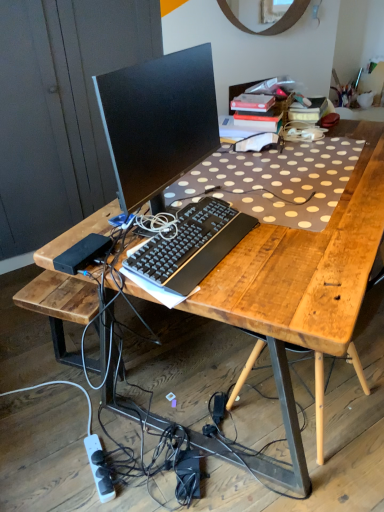
At what (x,y) coordinates should I click in order to perform the action: click on wooden desk at center. Please return your answer as a coordinate pair (x, y). Looking at the image, I should click on (304, 281).

At what (x,y) coordinates should I click in order to perform the action: click on white plastic power strip at lower left. Please return your answer as a coordinate pair (x, y). Image resolution: width=384 pixels, height=512 pixels. Looking at the image, I should click on (99, 469).

From the image's perspective, which object appears higher, wooden desk at center or matte black monitor at center?

matte black monitor at center.

Considering the sizes of wooden desk at center and matte black monitor at center in the image, is wooden desk at center bigger or smaller than matte black monitor at center?

In the image, wooden desk at center appears to be larger than matte black monitor at center.

Which is closer, [318,236] or [200,66]?

Point [318,236] appears to be farther away from the viewer than point [200,66].

Find the location of a particular element. desk lying on the right of matte black monitor at center is located at coordinates (304, 281).

Is wooden at right completely or partially inside matte black monitor at center?

No, wooden at right is not inside matte black monitor at center.

Does matte black monitor at center have a lesser height compared to wooden at right?

Yes.

Is matte black monitor at center in contact with wooden at right?

No, matte black monitor at center is not beside wooden at right.

What's the angular difference between wooden at right and matte black monitor at center's facing directions?

179 degrees.

Who is shorter, wooden at right or matte black monitor at center?

Standing shorter between the two is matte black monitor at center.

Based on the photo, could you tell me if wooden at right is facing matte black monitor at center?

No, wooden at right is not aimed at matte black monitor at center.

From the image's perspective, is wooden at right under matte black monitor at center?

Yes, from the image's perspective, wooden at right is beneath matte black monitor at center.

You are a GUI agent. You are given a task and a screenshot of the screen. Output one action in this format:
    pyautogui.click(x=<x>, y=<y>)
    Task: Click on the extension cord behind the wooden at right
    
    Given the screenshot: What is the action you would take?
    pyautogui.click(x=99, y=469)

Considering the sizes of objects white plastic power strip at lower left and wooden at right in the image provided, who is thinner, white plastic power strip at lower left or wooden at right?

Thinner between the two is white plastic power strip at lower left.

Is point (104, 493) less distant than point (246, 375)?

Yes, point (104, 493) is closer to viewer.

From the picture: How many degrees apart are the facing directions of white plastic power strip at lower left and wooden at right?

The angle between the facing direction of white plastic power strip at lower left and the facing direction of wooden at right is 142 degrees.

From a real-world perspective, between black plastic keyboard at center and wooden at right, who is vertically higher?

black plastic keyboard at center is physically above.

Is wooden at right at the back of black plastic keyboard at center?

That's not correct — black plastic keyboard at center is not looking away from wooden at right.

Based on the photo, can we say black plastic keyboard at center lies outside wooden at right?

Yes, black plastic keyboard at center is outside of wooden at right.

Is white plastic power strip at lower left wider than matte black monitor at center?

Yes.

From a real-world perspective, is white plastic power strip at lower left above or below matte black monitor at center?

white plastic power strip at lower left is below matte black monitor at center.

Considering the sizes of objects white plastic power strip at lower left and matte black monitor at center in the image provided, who is smaller, white plastic power strip at lower left or matte black monitor at center?

white plastic power strip at lower left is smaller.

How far apart are white plastic power strip at lower left and matte black monitor at center?

A distance of 1.07 meters exists between white plastic power strip at lower left and matte black monitor at center.

Is wooden desk at center far from white plastic power strip at lower left?

Answer: wooden desk at center is near white plastic power strip at lower left, not far away.

Which is in front, point (37, 291) or point (104, 487)?

The point (104, 487) is in front.

Considering the relative sizes of wooden desk at center and white plastic power strip at lower left in the image provided, is wooden desk at center thinner than white plastic power strip at lower left?

No.

From a real-world perspective, which is physically below, wooden desk at center or white plastic power strip at lower left?

white plastic power strip at lower left is physically lower.

At what (x,y) coordinates should I click in order to perform the action: click on desk lying on the right of matte black monitor at center. Please return your answer as a coordinate pair (x, y). Image resolution: width=384 pixels, height=512 pixels. Looking at the image, I should click on (304, 281).

Locate an element on the screen. This screenshot has height=512, width=384. computer chair directly beneath the matte black monitor at center (from a real-world perspective) is located at coordinates (319, 405).

When comparing their distances from wooden desk at center, does matte black monitor at center or wooden at right seem closer?

matte black monitor at center.

From the image, which object appears to be farther from matte black monitor at center, wooden at right or wooden desk at center?

Among the two, wooden at right is located further to matte black monitor at center.

Based on their spatial positions, is wooden desk at center or wooden at right further from white plastic power strip at lower left?

Among the two, wooden desk at center is located further to white plastic power strip at lower left.

Based on their spatial positions, is wooden desk at center or white plastic power strip at lower left further from wooden at right?

Based on the image, white plastic power strip at lower left appears to be further to wooden at right.

Considering their positions, is white plastic power strip at lower left positioned closer to wooden desk at center than black plastic keyboard at center?

Based on the image, black plastic keyboard at center appears to be nearer to wooden desk at center.

When comparing their distances from wooden at right, does black plastic keyboard at center or wooden desk at center seem further?

black plastic keyboard at center lies further to wooden at right than the other object.

From the image, which object appears to be farther from wooden at right, wooden desk at center or black plastic keyboard at center?

black plastic keyboard at center is further to wooden at right.

When comparing their distances from white plastic power strip at lower left, does black plastic keyboard at center or matte black monitor at center seem further?

matte black monitor at center is positioned further to the anchor white plastic power strip at lower left.

The height and width of the screenshot is (512, 384). In order to click on desk between black plastic keyboard at center and white plastic power strip at lower left from top to bottom in this screenshot , I will do (x=304, y=281).

I want to click on desk between black plastic keyboard at center and wooden at right from left to right, so click(304, 281).

The image size is (384, 512). Identify the location of computer chair between matte black monitor at center and white plastic power strip at lower left in the vertical direction. (319, 405).

The width and height of the screenshot is (384, 512). I want to click on desk between matte black monitor at center and white plastic power strip at lower left vertically, so click(x=304, y=281).